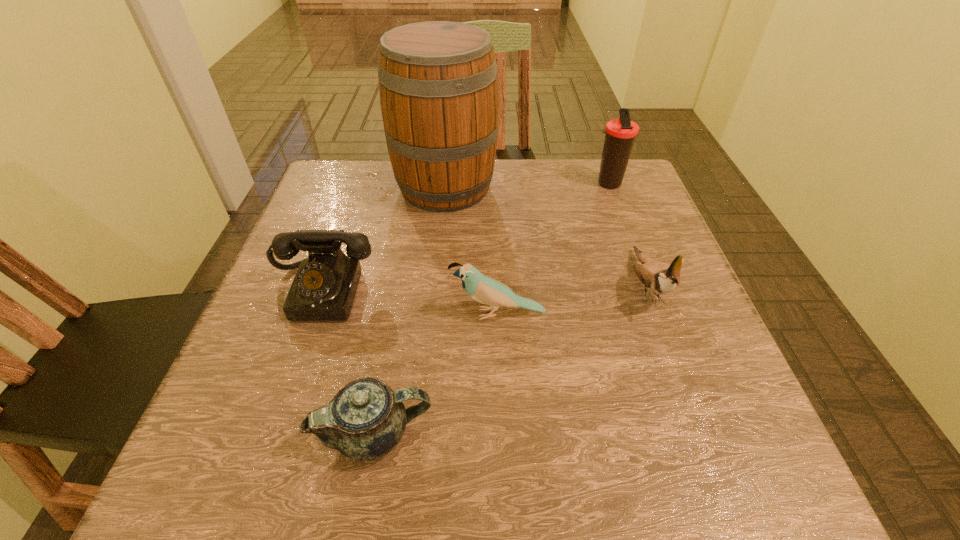
Select which object appears as the fourth closest to the nearest object. Please provide its 2D coordinates. Your answer should be formatted as a tuple, i.e. [(x, y)], where the tuple contains the x and y coordinates of a point satisfying the conditions above.

[(438, 84)]

I want to click on vacant space that satisfies the following two spatial constraints: 1. at the face of the right bird; 2. from the spout of the shortest object, so click(x=701, y=433).

Locate an element on the screen. The image size is (960, 540). free spot that satisfies the following two spatial constraints: 1. at the face of the right bird; 2. from the spout of the chinaware is located at coordinates (701, 433).

Where is `vacant region that satisfies the following two spatial constraints: 1. at the face of the right bird; 2. at the face of the left bird`? Image resolution: width=960 pixels, height=540 pixels. vacant region that satisfies the following two spatial constraints: 1. at the face of the right bird; 2. at the face of the left bird is located at coordinates (657, 314).